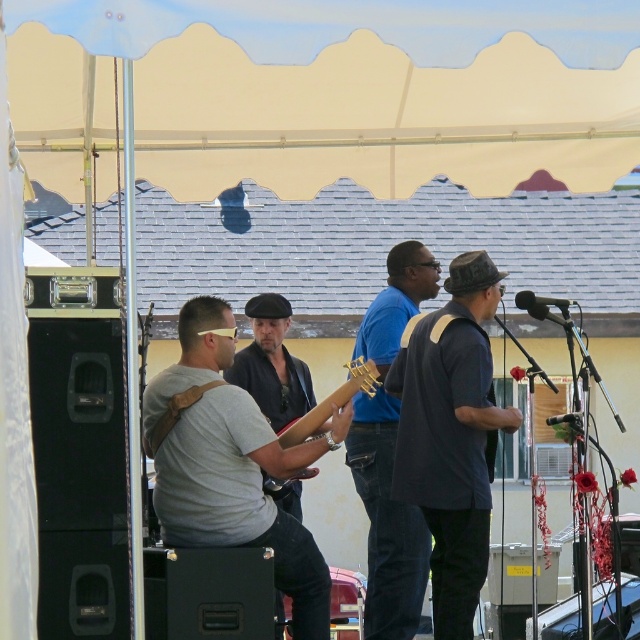
Is matte black guitar at center to the right of wooden acoustic guitar at center from the viewer's perspective?

In fact, matte black guitar at center is to the left of wooden acoustic guitar at center.

Does matte black guitar at center appear under wooden acoustic guitar at center?

Indeed, matte black guitar at center is positioned under wooden acoustic guitar at center.

Describe the element at coordinates (272, 364) in the screenshot. I see `matte black guitar at center` at that location.

Locate an element on the screen. The height and width of the screenshot is (640, 640). matte black guitar at center is located at coordinates (272, 364).

Who is positioned more to the right, blue matte guitar at center or matte brown guitar at center?

Positioned to the right is blue matte guitar at center.

What are the coordinates of `blue matte guitar at center` in the screenshot? It's located at (387, 524).

Does point (387, 627) come in front of point (268, 481)?

No, it is not.

Can you confirm if blue matte guitar at center is wider than wooden acoustic guitar at center?

In fact, blue matte guitar at center might be narrower than wooden acoustic guitar at center.

The height and width of the screenshot is (640, 640). Describe the element at coordinates (387, 524) in the screenshot. I see `blue matte guitar at center` at that location.

What are the coordinates of `blue matte guitar at center` in the screenshot? It's located at (387, 524).